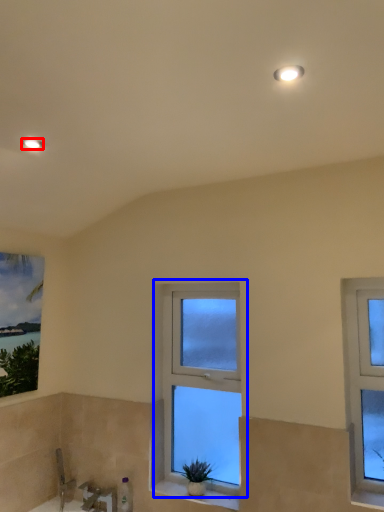
Question: Among these objects, which one is farthest to the camera, light fixture (highlighted by a red box) or window (highlighted by a blue box)?

Choices:
 (A) light fixture
 (B) window

Answer: (B)